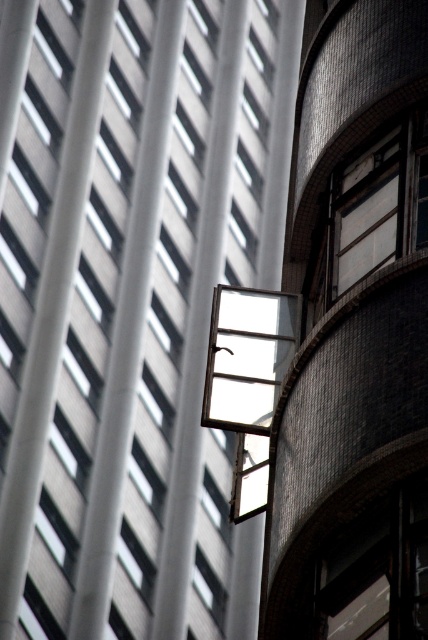
Question: Among these points, which one is nearest to the camera?

Choices:
 (A) (259, 292)
 (B) (127, 508)

Answer: (A)

Question: Observing the image, what is the correct spatial positioning of transparent glass window at center in reference to metallic glass window at upper right?

Choices:
 (A) below
 (B) above

Answer: (B)

Question: Can you confirm if transparent glass window at center is smaller than metallic glass window at upper right?

Choices:
 (A) no
 (B) yes

Answer: (A)

Question: Does transparent glass window at center have a larger size compared to metallic glass window at upper right?

Choices:
 (A) no
 (B) yes

Answer: (B)